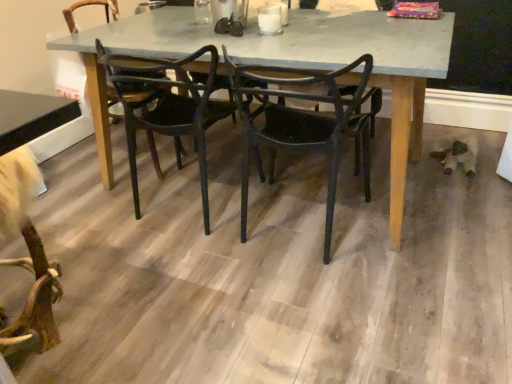
Describe the element at coordinates (168, 106) in the screenshot. I see `black plastic chair at center, which ranks as the first chair in left-to-right order` at that location.

This screenshot has width=512, height=384. Identify the location of black plastic chair at center, which ranks as the first chair in left-to-right order. (168, 106).

This screenshot has width=512, height=384. What do you see at coordinates (302, 122) in the screenshot?
I see `black matte chair at center, positioned as the second chair in left-to-right order` at bounding box center [302, 122].

Locate an element on the screen. This screenshot has width=512, height=384. black plastic chair at center, which ranks as the first chair in left-to-right order is located at coordinates (168, 106).

Which is more to the right, wooden floor at center or matte gray table at center?

matte gray table at center is more to the right.

Is the surface of wooden floor at center in direct contact with matte gray table at center?

wooden floor at center and matte gray table at center are clearly separated.

How much distance is there between wooden floor at center and matte gray table at center?

A distance of 21.77 inches exists between wooden floor at center and matte gray table at center.

From the picture: Considering the relative positions of black plastic chair at center, the second chair when ordered from right to left, and matte gray table at center in the image provided, is black plastic chair at center, the second chair when ordered from right to left, to the left or to the right of matte gray table at center?

Clearly, black plastic chair at center, the second chair when ordered from right to left, is on the left of matte gray table at center in the image.

From the picture: Is black plastic chair at center, which ranks as the first chair in left-to-right order, positioned with its back to matte gray table at center?

Yes, matte gray table at center is at the back of black plastic chair at center, which ranks as the first chair in left-to-right order.

Considering their positions, is black plastic chair at center, the second chair when ordered from right to left, located in front of or behind matte gray table at center?

black plastic chair at center, the second chair when ordered from right to left, is positioned farther from the viewer than matte gray table at center.

From a real-world perspective, which object stands above the other?

black plastic chair at center, the second chair when ordered from right to left.

How far apart are matte gray table at center and black matte chair at center, the first chair from the right?

matte gray table at center and black matte chair at center, the first chair from the right, are 11.84 inches apart from each other.

From a real-world perspective, is matte gray table at center physically located above or below black matte chair at center, positioned as the second chair in left-to-right order?

In terms of real-world spatial position, matte gray table at center is below black matte chair at center, positioned as the second chair in left-to-right order.

Which is in front, matte gray table at center or black matte chair at center, positioned as the second chair in left-to-right order?

black matte chair at center, positioned as the second chair in left-to-right order, is in front.

From the image's perspective, is matte gray table at center above black matte chair at center, positioned as the second chair in left-to-right order?

Yes.

Who is shorter, wooden floor at center or black plastic chair at center, which ranks as the first chair in left-to-right order?

Standing shorter between the two is wooden floor at center.

Considering the relative sizes of wooden floor at center and black plastic chair at center, the second chair when ordered from right to left, in the image provided, is wooden floor at center thinner than black plastic chair at center, the second chair when ordered from right to left,?

No.

Which object is positioned more to the left, wooden floor at center or black plastic chair at center, which ranks as the first chair in left-to-right order?

Positioned to the left is black plastic chair at center, which ranks as the first chair in left-to-right order.

Considering the positions of points (492, 349) and (143, 93), is point (492, 349) farther from camera compared to point (143, 93)?

No, (492, 349) is in front of (143, 93).

From the image's perspective, is black matte chair at center, positioned as the second chair in left-to-right order, beneath wooden floor at center?

Actually, black matte chair at center, positioned as the second chair in left-to-right order, appears above wooden floor at center in the image.

Measure the distance from black matte chair at center, the first chair from the right, to wooden floor at center.

They are 16.59 inches apart.

Looking at the image, does black matte chair at center, positioned as the second chair in left-to-right order, seem bigger or smaller compared to wooden floor at center?

Clearly, black matte chair at center, positioned as the second chair in left-to-right order, is larger in size than wooden floor at center.

Is black matte chair at center, the first chair from the right, surrounding wooden floor at center?

No, wooden floor at center is not surrounded by black matte chair at center, the first chair from the right.

Which is behind, black plastic chair at center, the second chair when ordered from right to left, or wooden floor at center?

black plastic chair at center, the second chair when ordered from right to left, is behind.

Considering the sizes of objects black plastic chair at center, the second chair when ordered from right to left, and wooden floor at center in the image provided, who is bigger, black plastic chair at center, the second chair when ordered from right to left, or wooden floor at center?

black plastic chair at center, the second chair when ordered from right to left.

From the image's perspective, is black plastic chair at center, which ranks as the first chair in left-to-right order, located above or below wooden floor at center?

Based on their image positions, black plastic chair at center, which ranks as the first chair in left-to-right order, is located above wooden floor at center.

In the image, is black plastic chair at center, which ranks as the first chair in left-to-right order, on the left side or the right side of black matte chair at center, positioned as the second chair in left-to-right order?

In the image, black plastic chair at center, which ranks as the first chair in left-to-right order, appears on the left side of black matte chair at center, positioned as the second chair in left-to-right order.

Can you confirm if black plastic chair at center, which ranks as the first chair in left-to-right order, is taller than black matte chair at center, positioned as the second chair in left-to-right order?

No, black plastic chair at center, which ranks as the first chair in left-to-right order, is not taller than black matte chair at center, positioned as the second chair in left-to-right order.

Would you say black plastic chair at center, the second chair when ordered from right to left, contains black matte chair at center, the first chair from the right?

No, black matte chair at center, the first chair from the right, is not inside black plastic chair at center, the second chair when ordered from right to left.

How different are the orientations of black plastic chair at center, which ranks as the first chair in left-to-right order, and black matte chair at center, positioned as the second chair in left-to-right order, in degrees?

The angle between the facing direction of black plastic chair at center, which ranks as the first chair in left-to-right order, and the facing direction of black matte chair at center, positioned as the second chair in left-to-right order, is 0.000771 degrees.

Locate an element on the screen. Image resolution: width=512 pixels, height=384 pixels. kitchen & dining room table positioned vertically above the wooden floor at center (from a real-world perspective) is located at coordinates (290, 66).

In order to click on chair behind the matte gray table at center in this screenshot , I will do `click(168, 106)`.

Consider the image. When comparing their distances from matte gray table at center, does black matte chair at center, the first chair from the right, or black plastic chair at center, the second chair when ordered from right to left, seem closer?

Based on the image, black plastic chair at center, the second chair when ordered from right to left, appears to be nearer to matte gray table at center.

Estimate the real-world distances between objects in this image. Which object is further from black matte chair at center, positioned as the second chair in left-to-right order, black plastic chair at center, the second chair when ordered from right to left, or matte gray table at center?

The object further to black matte chair at center, positioned as the second chair in left-to-right order, is black plastic chair at center, the second chair when ordered from right to left.

Based on the photo, which object lies further to the anchor point black plastic chair at center, the second chair when ordered from right to left, black matte chair at center, the first chair from the right, or matte gray table at center?

black matte chair at center, the first chair from the right, lies further to black plastic chair at center, the second chair when ordered from right to left, than the other object.

From the image, which object appears to be farther from black matte chair at center, positioned as the second chair in left-to-right order, wooden floor at center or black plastic chair at center, the second chair when ordered from right to left?

wooden floor at center.

Based on their spatial positions, is wooden floor at center or matte gray table at center further from black matte chair at center, positioned as the second chair in left-to-right order?

The object further to black matte chair at center, positioned as the second chair in left-to-right order, is wooden floor at center.

Based on their spatial positions, is matte gray table at center or black matte chair at center, the first chair from the right, closer to black plastic chair at center, the second chair when ordered from right to left?

Based on the image, matte gray table at center appears to be nearer to black plastic chair at center, the second chair when ordered from right to left.

Which object lies nearer to the anchor point matte gray table at center, black plastic chair at center, the second chair when ordered from right to left, or black matte chair at center, positioned as the second chair in left-to-right order?

Based on the image, black plastic chair at center, the second chair when ordered from right to left, appears to be nearer to matte gray table at center.

Considering their positions, is matte gray table at center positioned closer to black matte chair at center, positioned as the second chair in left-to-right order, than wooden floor at center?

matte gray table at center lies closer to black matte chair at center, positioned as the second chair in left-to-right order, than the other object.

This screenshot has width=512, height=384. Identify the location of kitchen & dining room table located between black plastic chair at center, which ranks as the first chair in left-to-right order, and black matte chair at center, positioned as the second chair in left-to-right order, in the left-right direction. (290, 66).

In order to click on chair between wooden floor at center and matte gray table at center along the z-axis in this screenshot , I will do `click(302, 122)`.

Find the location of a particular element. This screenshot has height=384, width=512. kitchen & dining room table between wooden floor at center and black plastic chair at center, which ranks as the first chair in left-to-right order, from front to back is located at coordinates (290, 66).

Locate an element on the screen. Image resolution: width=512 pixels, height=384 pixels. chair between wooden floor at center and black plastic chair at center, which ranks as the first chair in left-to-right order, along the z-axis is located at coordinates (302, 122).